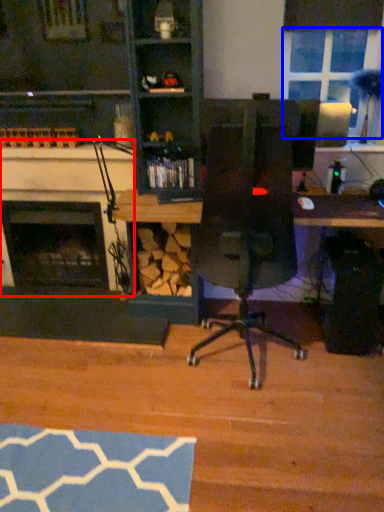
Question: Which of the following is the closest to the observer, fireplace (highlighted by a red box) or window screen (highlighted by a blue box)?

Choices:
 (A) fireplace
 (B) window screen

Answer: (B)